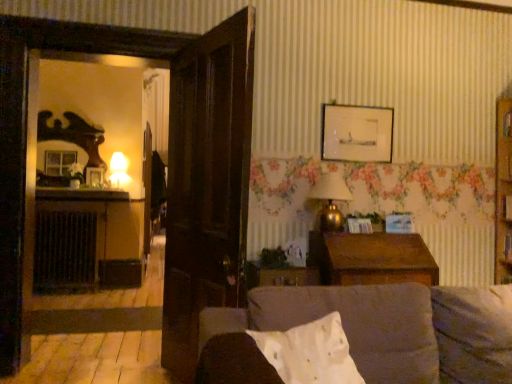
Question: Does matte glass lamp at left, acting as the first lamp starting from the back, appear on the left side of gold metallic lamp at upper right, which is the 2th lamp from left to right?

Choices:
 (A) yes
 (B) no

Answer: (A)

Question: Is the surface of matte glass lamp at left, acting as the first lamp starting from the back, in direct contact with gold metallic lamp at upper right, marked as the 1th lamp in a right-to-left arrangement?

Choices:
 (A) no
 (B) yes

Answer: (A)

Question: Is matte glass lamp at left, placed as the first lamp when sorted from top to bottom, not within gold metallic lamp at upper right, which is the 2th lamp from left to right?

Choices:
 (A) yes
 (B) no

Answer: (A)

Question: Can you confirm if matte glass lamp at left, placed as the second lamp when sorted from bottom to top, is bigger than gold metallic lamp at upper right, which is the 1th lamp from bottom to top?

Choices:
 (A) no
 (B) yes

Answer: (A)

Question: Does matte glass lamp at left, acting as the first lamp starting from the back, have a smaller size compared to gold metallic lamp at upper right, which is the 2th lamp from left to right?

Choices:
 (A) yes
 (B) no

Answer: (A)

Question: Would you say gold metallic lamp at upper right, positioned as the 2th lamp in top-to-bottom order, is to the left or to the right of wooden picture frame at upper center, the first picture frame when ordered from right to left, in the picture?

Choices:
 (A) right
 (B) left

Answer: (B)

Question: Choose the correct answer: Is gold metallic lamp at upper right, which is counted as the 2th lamp, starting from the back, inside wooden picture frame at upper center, placed as the second picture frame when sorted from bottom to top, or outside it?

Choices:
 (A) outside
 (B) inside

Answer: (A)

Question: In the image, is gold metallic lamp at upper right, which is the 2th lamp from left to right, positioned in front of or behind wooden picture frame at upper center, the first picture frame when ordered from right to left?

Choices:
 (A) front
 (B) behind

Answer: (A)

Question: Is gold metallic lamp at upper right, which is the 2th lamp from left to right, taller or shorter than wooden picture frame at upper center, the first picture frame positioned from the front?

Choices:
 (A) short
 (B) tall

Answer: (B)

Question: Is black metal radiator at left bigger or smaller than white cotton pillow at center?

Choices:
 (A) big
 (B) small

Answer: (A)

Question: From their relative heights in the image, would you say black metal radiator at left is taller or shorter than white cotton pillow at center?

Choices:
 (A) tall
 (B) short

Answer: (A)

Question: From the image's perspective, is black metal radiator at left located above or below white cotton pillow at center?

Choices:
 (A) above
 (B) below

Answer: (B)

Question: Looking at their shapes, would you say black metal radiator at left is wider or thinner than white cotton pillow at center?

Choices:
 (A) wide
 (B) thin

Answer: (B)

Question: Is wooden picture frame at upper center, which is the 2th picture frame in left-to-right order, situated inside velvet brown couch at center or outside?

Choices:
 (A) outside
 (B) inside

Answer: (A)

Question: Based on their sizes in the image, would you say wooden picture frame at upper center, placed as the second picture frame when sorted from bottom to top, is bigger or smaller than velvet brown couch at center?

Choices:
 (A) small
 (B) big

Answer: (A)